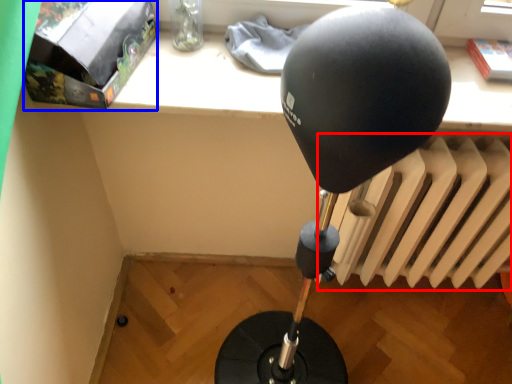
Question: Which point is further to the camera, radiator (highlighted by a red box) or package (highlighted by a blue box)?

Choices:
 (A) radiator
 (B) package

Answer: (A)